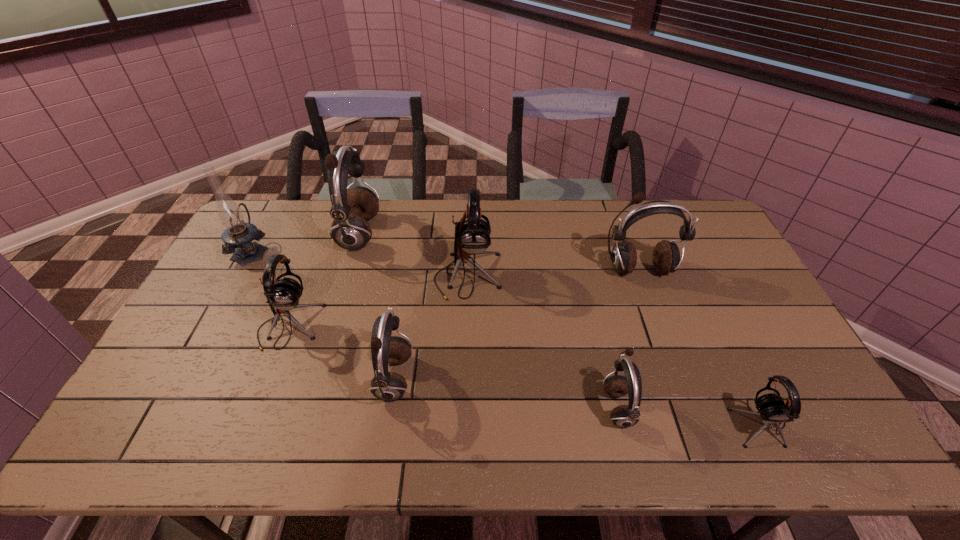
I want to click on the second brown earphone from right to left, so click(x=623, y=416).

Where is `the fifth earphone from left to right`? the fifth earphone from left to right is located at coordinates (623, 416).

Locate an element on the screen. The width and height of the screenshot is (960, 540). the smallest black earphone is located at coordinates [771, 407].

Identify the location of the nearest black earphone. The height and width of the screenshot is (540, 960). (771, 407).

Locate an element on the screen. blank space located on the ear pads of the tallest earphone is located at coordinates (451, 234).

This screenshot has width=960, height=540. I want to click on blank area located 0.190m on the right of the leftmost object, so click(x=323, y=251).

You are a GUI agent. You are given a task and a screenshot of the screen. Output one action in this format:
    pyautogui.click(x=<x>, y=<y>)
    Task: Click on the vacant space located 0.210m on the right of the fourth earphone from left to right
    
    Given the screenshot: What is the action you would take?
    pyautogui.click(x=566, y=275)

Where is `blank area located on the ear pads of the rightmost brown earphone`? The width and height of the screenshot is (960, 540). blank area located on the ear pads of the rightmost brown earphone is located at coordinates click(667, 350).

In order to click on free space located 0.180m on the left of the second farthest black earphone in this screenshot , I will do click(x=198, y=327).

This screenshot has height=540, width=960. In order to click on free space located 0.080m on the ear pads of the fifth earphone from right to left in this screenshot , I will do `click(443, 380)`.